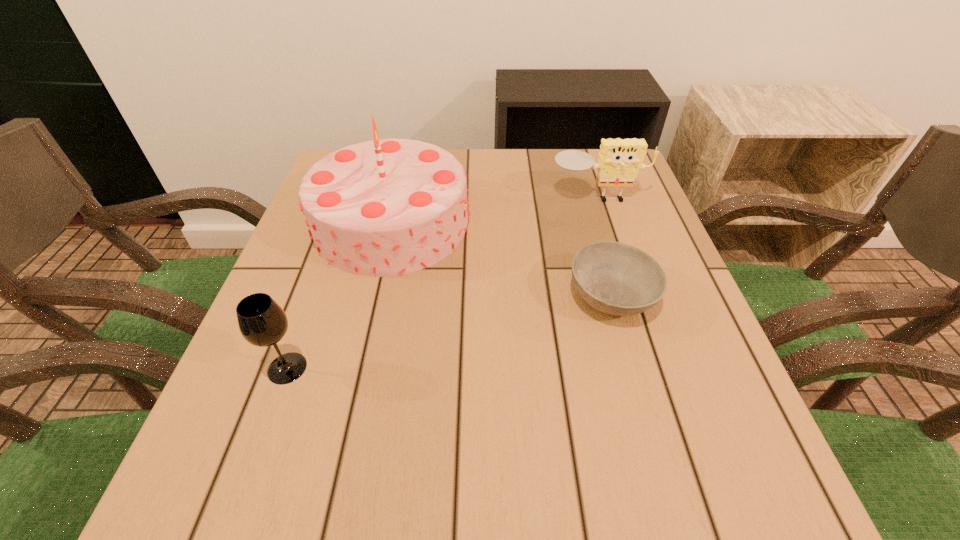
You are a GUI agent. You are given a task and a screenshot of the screen. Output one action in this format:
    pyautogui.click(x=<x>, y=<y>)
    Task: Click on the free point between the tallest object and the bowl
    This screenshot has height=540, width=960.
    Given the screenshot: What is the action you would take?
    pyautogui.click(x=501, y=260)

You are a GUI agent. You are given a task and a screenshot of the screen. Output one action in this format:
    pyautogui.click(x=<x>, y=<y>)
    Task: Click on the free space between the wineglass and the sponge
    
    Given the screenshot: What is the action you would take?
    pyautogui.click(x=443, y=282)

Where is `vacant area that lies between the shortest object and the nearest object`? The image size is (960, 540). vacant area that lies between the shortest object and the nearest object is located at coordinates (449, 332).

In order to click on blank region between the wineglass and the birthday cake in this screenshot , I will do `click(339, 295)`.

What are the coordinates of `vacant space that is in between the tallest object and the sponge` in the screenshot? It's located at (494, 210).

This screenshot has width=960, height=540. I want to click on object that stands as the second closest to the wineglass, so click(x=615, y=278).

Identify the location of object that ranks as the second closest to the sponge. (615, 278).

You are a GUI agent. You are given a task and a screenshot of the screen. Output one action in this format:
    pyautogui.click(x=<x>, y=<y>)
    Task: Click on the vacant space that satisfies the following two spatial constraints: 1. on the front side of the bowl; 2. on the left side of the tallest object
    The height and width of the screenshot is (540, 960).
    Given the screenshot: What is the action you would take?
    pyautogui.click(x=374, y=296)

This screenshot has height=540, width=960. I want to click on vacant space that satisfies the following two spatial constraints: 1. on the front side of the bowl; 2. on the left side of the tallest object, so click(x=374, y=296).